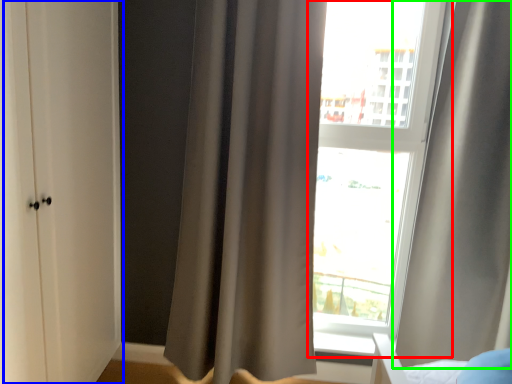
Question: Considering the real-world distances, which object is farthest from window (highlighted by a red box)? screen door (highlighted by a blue box) or curtain (highlighted by a green box)?

Choices:
 (A) screen door
 (B) curtain

Answer: (A)